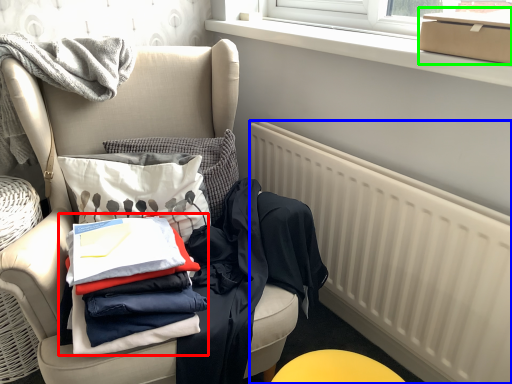
Question: Which object is positioned closest to clothing (highlighted by a red box)? Select from radiator (highlighted by a blue box) and box (highlighted by a green box).

Choices:
 (A) radiator
 (B) box

Answer: (A)